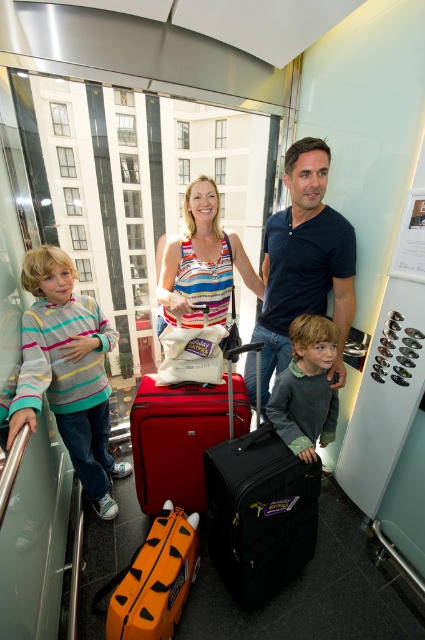
You are standing in the elevator and need to place your new matte black suitcase at center. Where should you put it to ensure it doesn

The matte black suitcase at center is already positioned at the coordinates point (x=302, y=264), so placing it there would be appropriate.

You are helping the family organize their luggage in the elevator. The black matte suitcase at center and the matte red suitcase at center need to be stacked vertically. Which one should go on the bottom to ensure stability?

The black matte suitcase at center is much taller than the matte red suitcase at center, so placing the taller one on the bottom would provide a stable base for stacking.